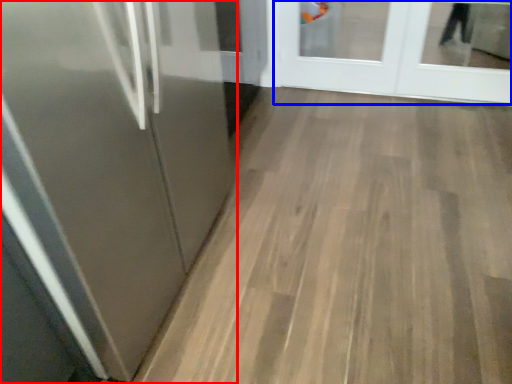
Question: Which point is further to the camera, door (highlighted by a red box) or door (highlighted by a blue box)?

Choices:
 (A) door
 (B) door

Answer: (B)